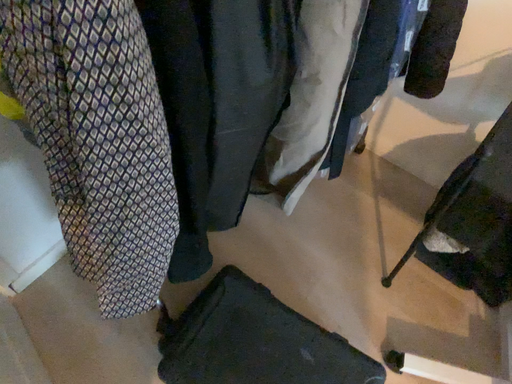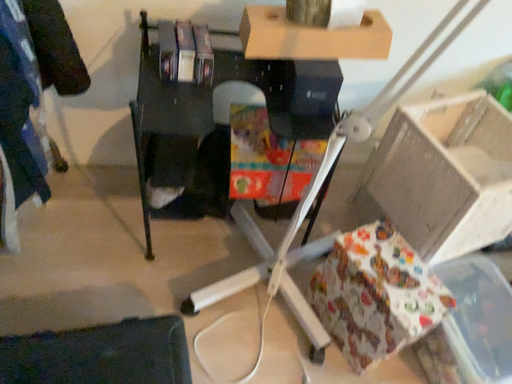
Question: Which way did the camera rotate in the video?

Choices:
 (A) rotated right
 (B) rotated left

Answer: (A)